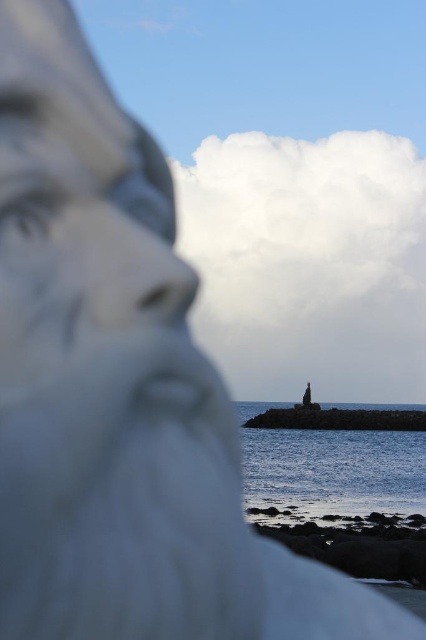
You are standing at the base of the large white sculpture in the coastal scene. Looking towards the ocean, you notice a specific point marked at coordinates point (333, 472). What does this point indicate?

The point (333, 472) marks blue water at lower center.

You are a photographer setting up equipment on the smooth concrete pier at center. You want to take a photo of the smooth stone statue at center. Based on their heights, will the statue be taller than the pier in your photo?

The smooth concrete pier at center is not as tall as the smooth stone statue at center, so yes, the smooth stone statue at center will appear taller than the smooth concrete pier at center in the photo.

You are standing on the beach and want to take a photo of the blue water at lower center and the smooth concrete pier at center. Which object will appear larger in your photo?

The blue water at lower center will appear larger in the photo because it is closer to the viewer than the smooth concrete pier at center.